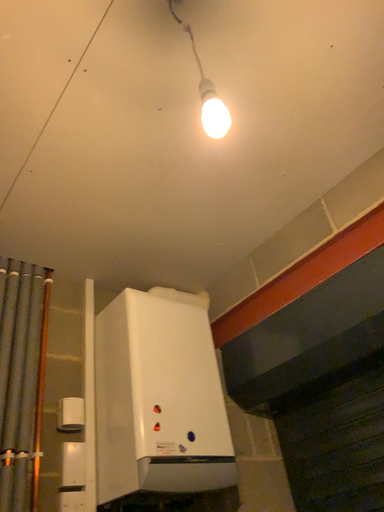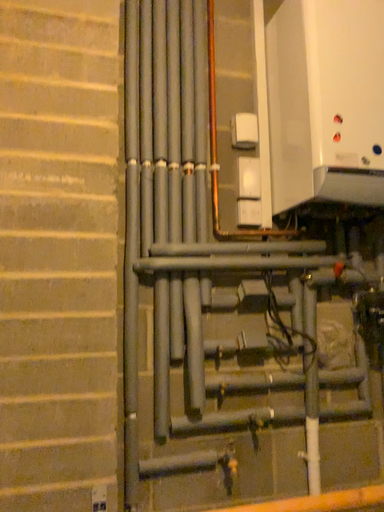
Question: Which way did the camera rotate in the video?

Choices:
 (A) rotated left
 (B) rotated right

Answer: (A)